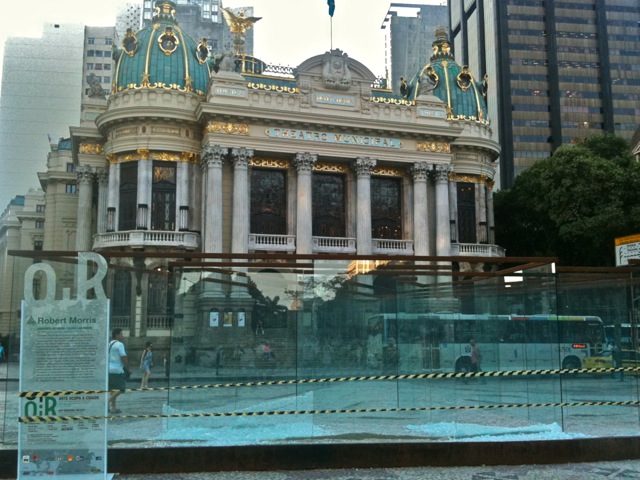
Find the location of a particular element. glass panels is located at coordinates (348, 342).